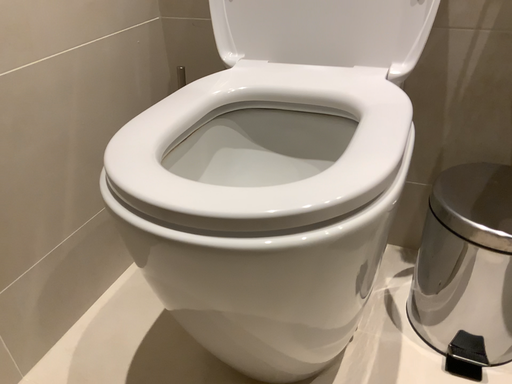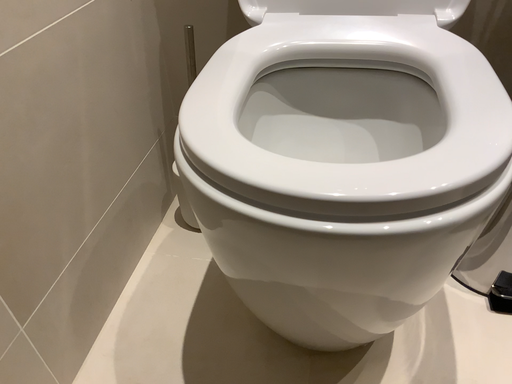
Question: Which way did the camera rotate in the video?

Choices:
 (A) rotated left
 (B) rotated right

Answer: (B)